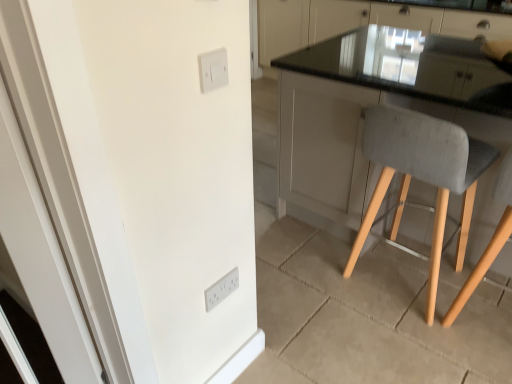
Question: Does black glass countertop at upper right have a greater width compared to white plastic light switch at upper center, the 1th light switch in the top-to-bottom sequence?

Choices:
 (A) yes
 (B) no

Answer: (A)

Question: Could you tell me if black glass countertop at upper right is turned towards white plastic light switch at upper center, the 1th light switch in the top-to-bottom sequence?

Choices:
 (A) no
 (B) yes

Answer: (B)

Question: From the image's perspective, is black glass countertop at upper right under white plastic light switch at upper center, the 2th light switch in the bottom-to-top sequence?

Choices:
 (A) yes
 (B) no

Answer: (B)

Question: Is black glass countertop at upper right not close to white plastic light switch at upper center, the 2th light switch in the bottom-to-top sequence?

Choices:
 (A) no
 (B) yes

Answer: (B)

Question: Is black glass countertop at upper right positioned beyond the bounds of white plastic light switch at upper center, the 1th light switch in the top-to-bottom sequence?

Choices:
 (A) no
 (B) yes

Answer: (B)

Question: Can you confirm if black glass countertop at upper right is shorter than white plastic light switch at upper center, the 1th light switch in the top-to-bottom sequence?

Choices:
 (A) no
 (B) yes

Answer: (A)

Question: Can you confirm if white glossy door at left is positioned to the right of black glass countertop at upper right?

Choices:
 (A) no
 (B) yes

Answer: (A)

Question: Can you confirm if white glossy door at left is smaller than black glass countertop at upper right?

Choices:
 (A) no
 (B) yes

Answer: (B)

Question: Can you confirm if white glossy door at left is taller than black glass countertop at upper right?

Choices:
 (A) yes
 (B) no

Answer: (A)

Question: From the image's perspective, is white glossy door at left above black glass countertop at upper right?

Choices:
 (A) yes
 (B) no

Answer: (B)

Question: Is white glossy door at left shorter than black glass countertop at upper right?

Choices:
 (A) yes
 (B) no

Answer: (B)

Question: Could you tell me if white glossy door at left is facing black glass countertop at upper right?

Choices:
 (A) no
 (B) yes

Answer: (A)

Question: Is white plastic light switch at lower center, which is the second light switch from top to bottom, smaller than black glass countertop at upper right?

Choices:
 (A) no
 (B) yes

Answer: (B)